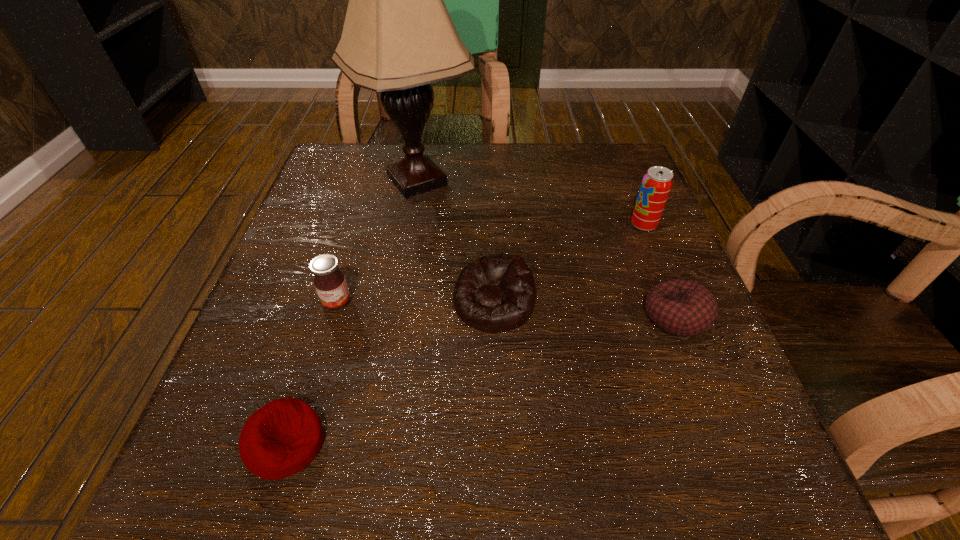
Locate an element on the screen. Image resolution: width=960 pixels, height=540 pixels. the tallest object is located at coordinates (398, 37).

Locate an element on the screen. The width and height of the screenshot is (960, 540). the fifth shortest object is located at coordinates (656, 185).

You are a GUI agent. You are given a task and a screenshot of the screen. Output one action in this format:
    pyautogui.click(x=<x>, y=<y>)
    Task: Click on the fourth shortest object
    
    Given the screenshot: What is the action you would take?
    pyautogui.click(x=329, y=281)

Locate an element on the screen. The width and height of the screenshot is (960, 540). the second beanbag from right to left is located at coordinates (496, 293).

The image size is (960, 540). Find the location of `the rightmost beanbag`. the rightmost beanbag is located at coordinates (681, 307).

The height and width of the screenshot is (540, 960). I want to click on the nearest object, so click(281, 438).

Where is `the nearest beanbag`? This screenshot has width=960, height=540. the nearest beanbag is located at coordinates (281, 438).

Where is `free space located 0.220m on the front of the tallest object`? This screenshot has width=960, height=540. free space located 0.220m on the front of the tallest object is located at coordinates (396, 302).

At what (x,y) coordinates should I click in order to perform the action: click on free spot located on the left of the soda can. Please return your answer as a coordinate pair (x, y). The image size is (960, 540). Looking at the image, I should click on (428, 225).

Find the location of a particular element. This screenshot has width=960, height=540. vacant space situated 0.160m on the label side of the jam is located at coordinates (306, 403).